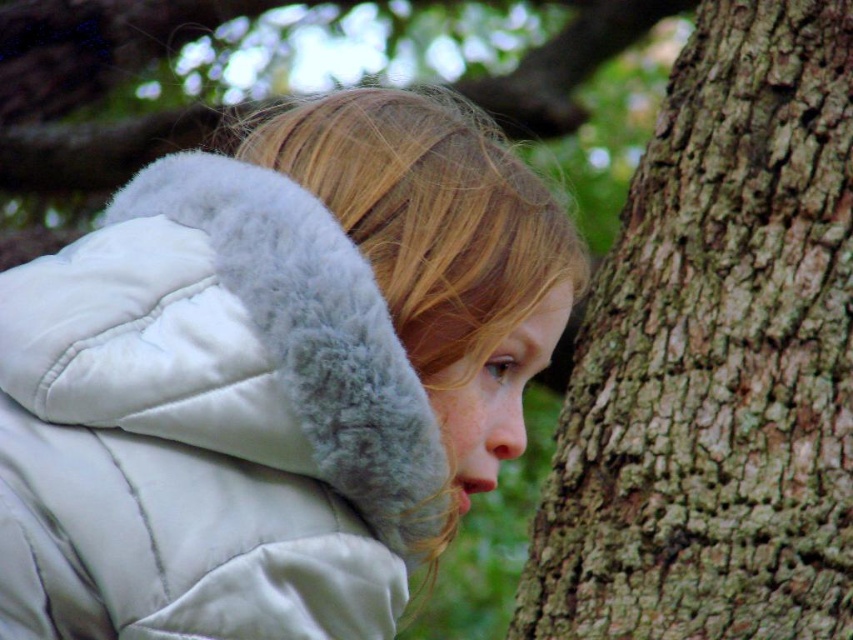
Question: Among these objects, which one is farthest from the camera?

Choices:
 (A) brown rough bark at right
 (B) white puffy jacket at center

Answer: (A)

Question: Is white puffy jacket at center above brown rough bark at right?

Choices:
 (A) yes
 (B) no

Answer: (A)

Question: Can you confirm if white puffy jacket at center is wider than brown rough bark at right?

Choices:
 (A) yes
 (B) no

Answer: (B)

Question: From the image, what is the correct spatial relationship of white puffy jacket at center in relation to brown rough bark at right?

Choices:
 (A) below
 (B) above

Answer: (B)